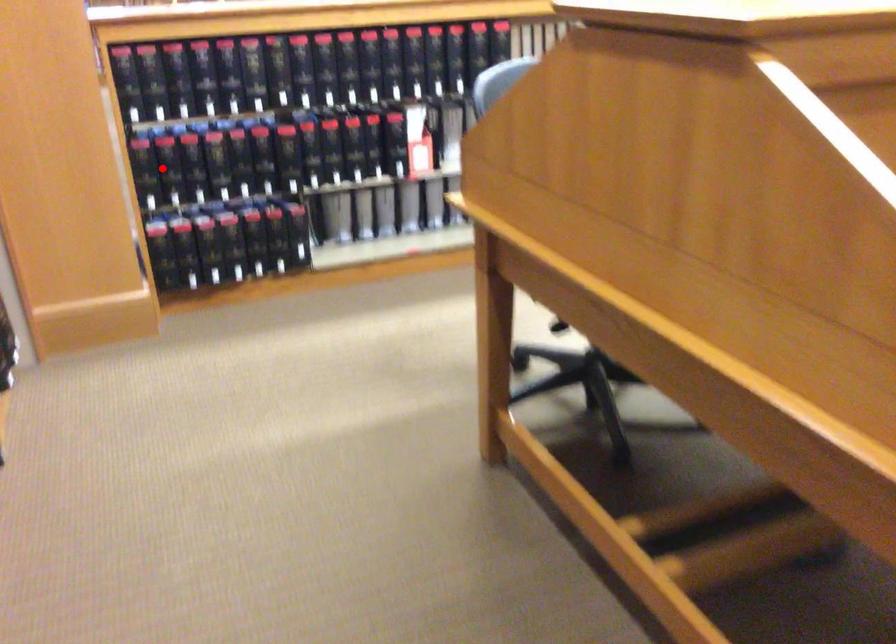
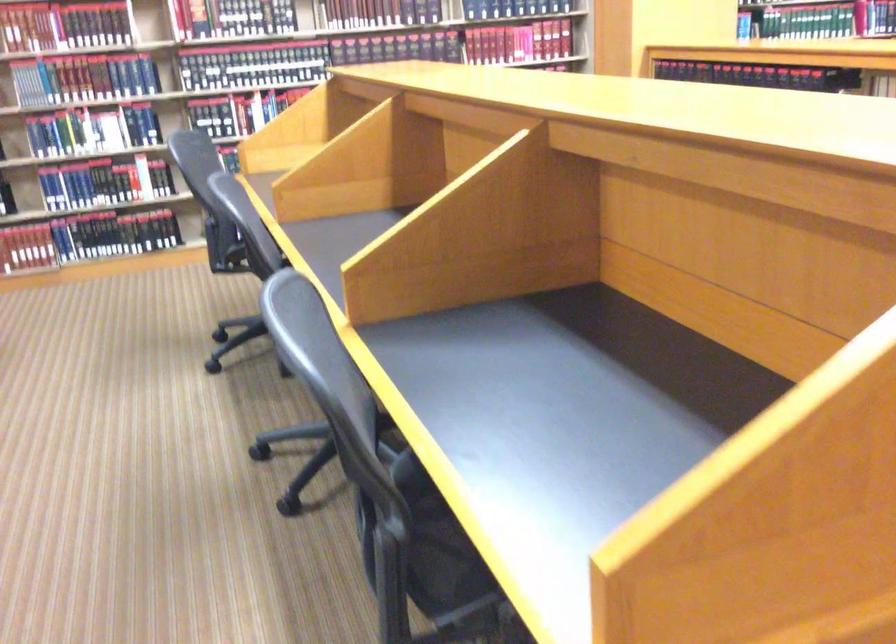
Question: I am providing you with two images of the same scene from different viewpoints. A red point is marked on the first image. Can you still see the location of the red point in image 2?

Choices:
 (A) Yes
 (B) No

Answer: (B)